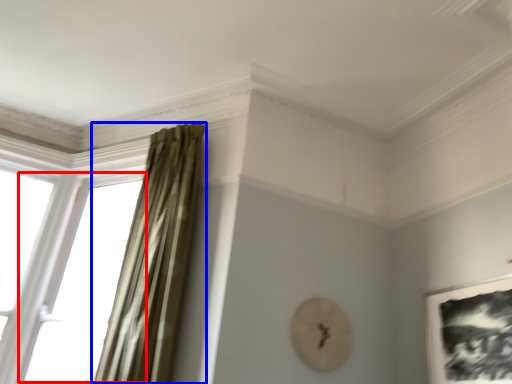
Question: Among these objects, which one is farthest to the camera, window (highlighted by a red box) or curtain (highlighted by a blue box)?

Choices:
 (A) window
 (B) curtain

Answer: (A)